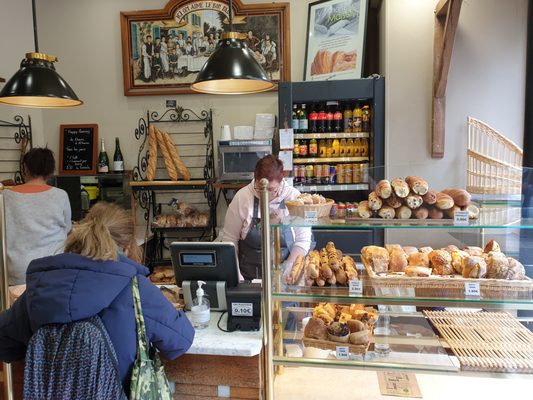
Where is `beverage refrigerator`? The image size is (533, 400). beverage refrigerator is located at coordinates (337, 148).